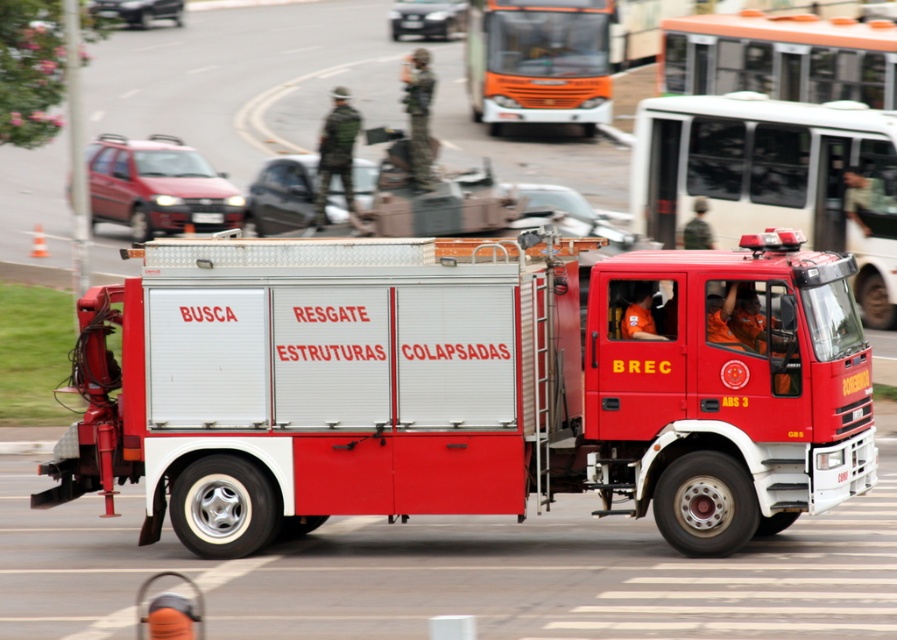
Who is shorter, white matte bus at upper center or metallic red car at center?

With less height is metallic red car at center.

Which is more to the right, white matte bus at upper center or metallic red car at center?

From the viewer's perspective, white matte bus at upper center appears more on the right side.

This screenshot has width=897, height=640. I want to click on white matte bus at upper center, so click(x=774, y=177).

Which is more to the left, metallic red fire truck at center or metallic silver bus at upper center?

metallic red fire truck at center

Is metallic red fire truck at center bigger than metallic silver bus at upper center?

Actually, metallic red fire truck at center might be smaller than metallic silver bus at upper center.

Locate an element on the screen. This screenshot has width=897, height=640. metallic red fire truck at center is located at coordinates (468, 387).

Between point (606, 10) and point (221, 212), which one is positioned in front?

Point (221, 212) is in front.

Can you confirm if orange matte bus at upper center is taller than black plastic license plate at center?

Yes, orange matte bus at upper center is taller than black plastic license plate at center.

Where is `orange matte bus at upper center`? The width and height of the screenshot is (897, 640). orange matte bus at upper center is located at coordinates (538, 61).